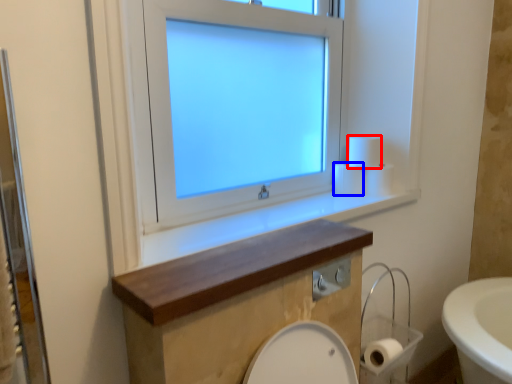
Question: Which point is further to the camera, toilet paper (highlighted by a red box) or toilet paper (highlighted by a blue box)?

Choices:
 (A) toilet paper
 (B) toilet paper

Answer: (B)